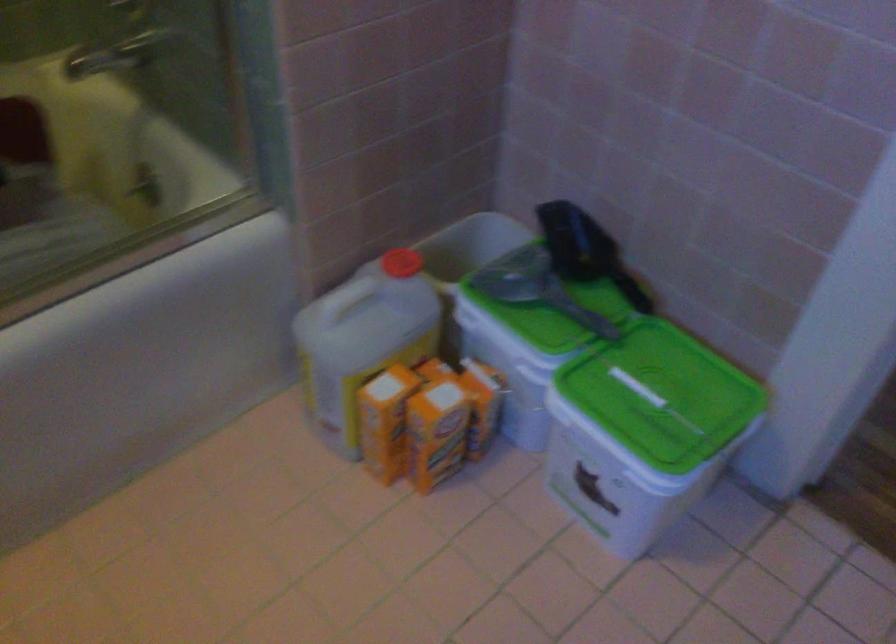
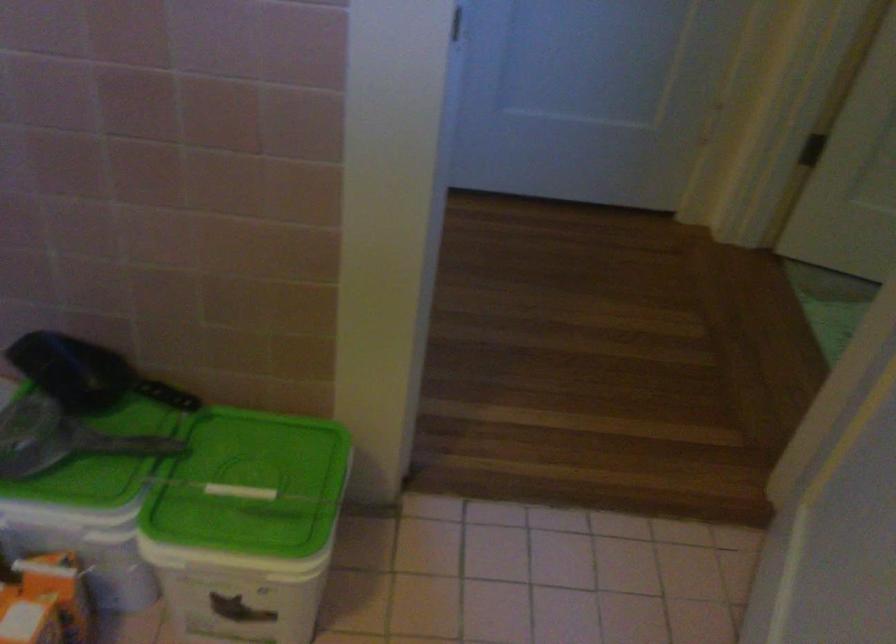
Question: The camera is either moving clockwise (left) or counter-clockwise (right) around the object. The first image is from the beginning of the video and the second image is from the end. Is the camera moving left or right when shooting the video?

Choices:
 (A) Left
 (B) Right

Answer: (A)